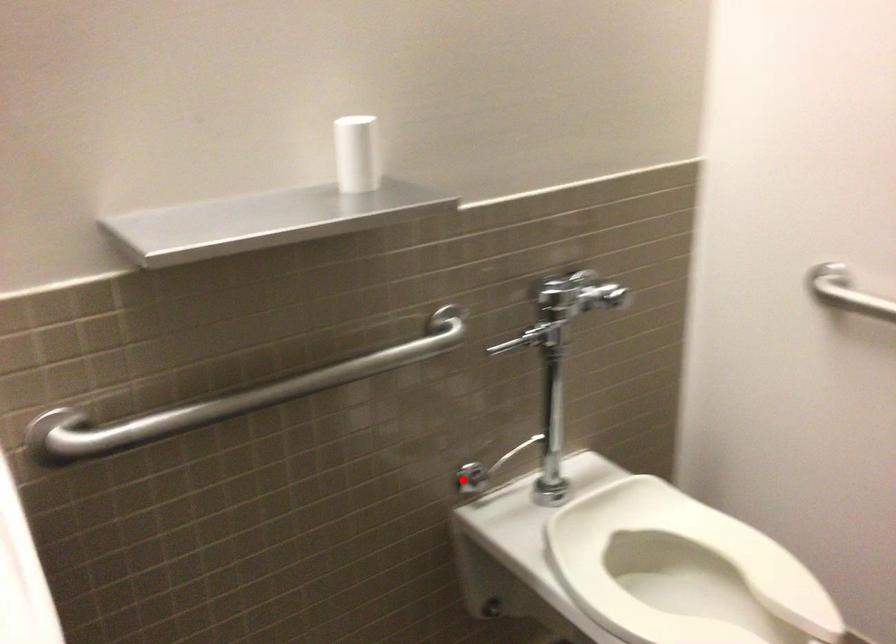
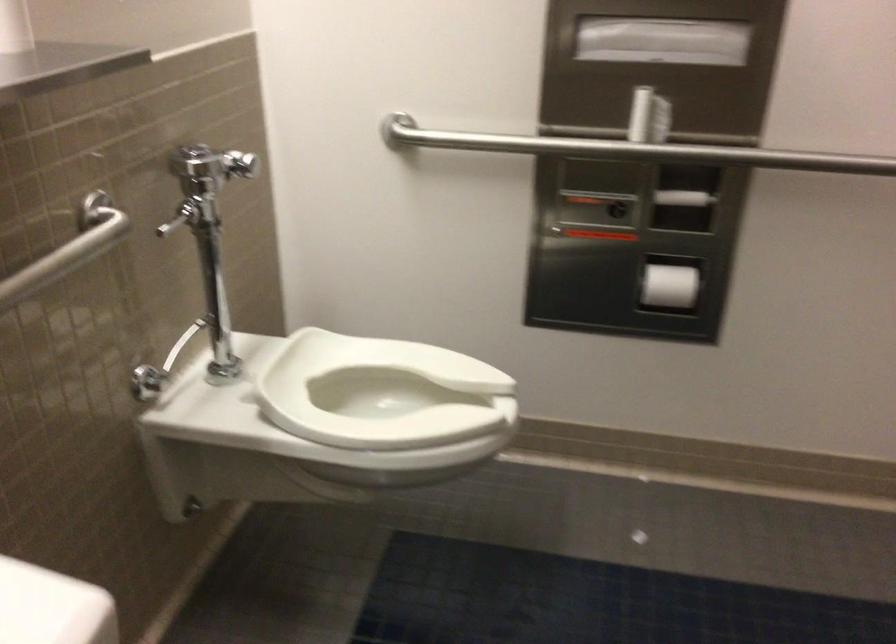
Locate, in the second image, the point that corresponds to the highlighted location in the first image.

(147, 383)